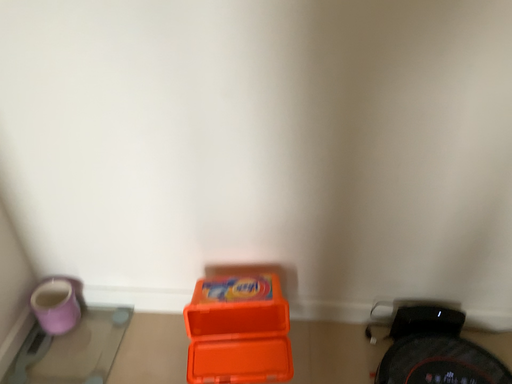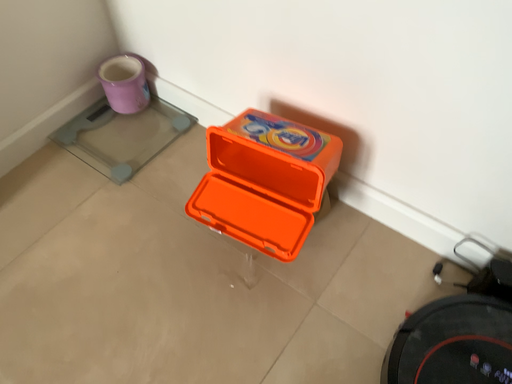
Question: Which way did the camera rotate in the video?

Choices:
 (A) rotated right
 (B) rotated left

Answer: (B)